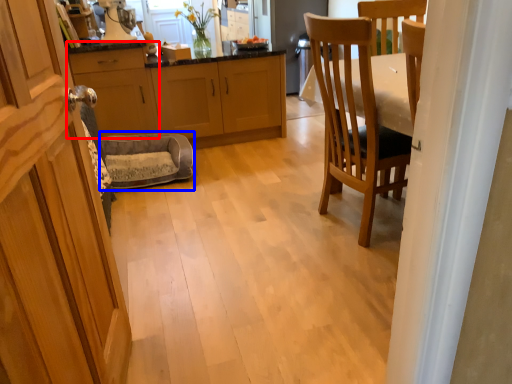
Question: Which object appears closest to the camera in this image, cabinetry (highlighted by a red box) or rocking chair (highlighted by a blue box)?

Choices:
 (A) cabinetry
 (B) rocking chair

Answer: (B)